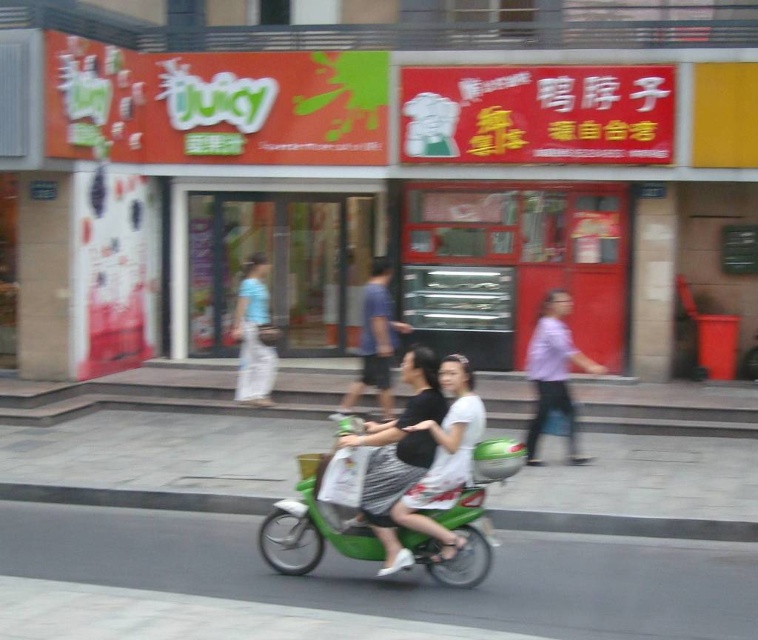
Question: Is white matte shirt at center above blue cotton shirt at center?

Choices:
 (A) no
 (B) yes

Answer: (A)

Question: Among these objects, which one is nearest to the camera?

Choices:
 (A) purple matte shirt at center
 (B) black textured dress at center
 (C) green matte motorcycle at center

Answer: (B)

Question: Based on their relative distances, which object is nearer to the blue cotton shirt at center?

Choices:
 (A) purple matte shirt at center
 (B) white matte shirt at center
 (C) black textured dress at center

Answer: (A)

Question: Which object appears closest to the camera in this image?

Choices:
 (A) green matte motorcycle at center
 (B) light blue fabric pants at left

Answer: (A)

Question: Is purple matte shirt at center wider than light blue fabric pants at left?

Choices:
 (A) no
 (B) yes

Answer: (B)

Question: Can you confirm if green matte motorcycle at center is smaller than light blue fabric pants at left?

Choices:
 (A) no
 (B) yes

Answer: (A)